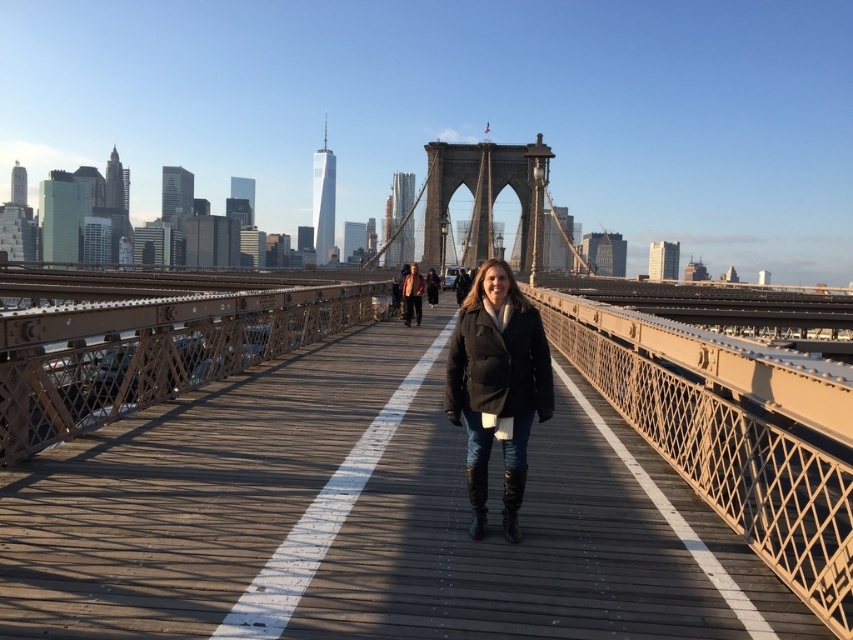
You are standing on the Brooklyn Bridge and see two points marked on the walkway. The first point is at coordinates point (457,378) and the second is at point (434,289). Which point is closer to you?

Point (457,378) is closer to the viewer than point (434,289).

You are standing on the Brooklyn Bridge and notice a brown metal bridge at center and a matte brown jacket at center. Which object is taller?

The brown metal bridge at center is taller than the matte brown jacket at center.